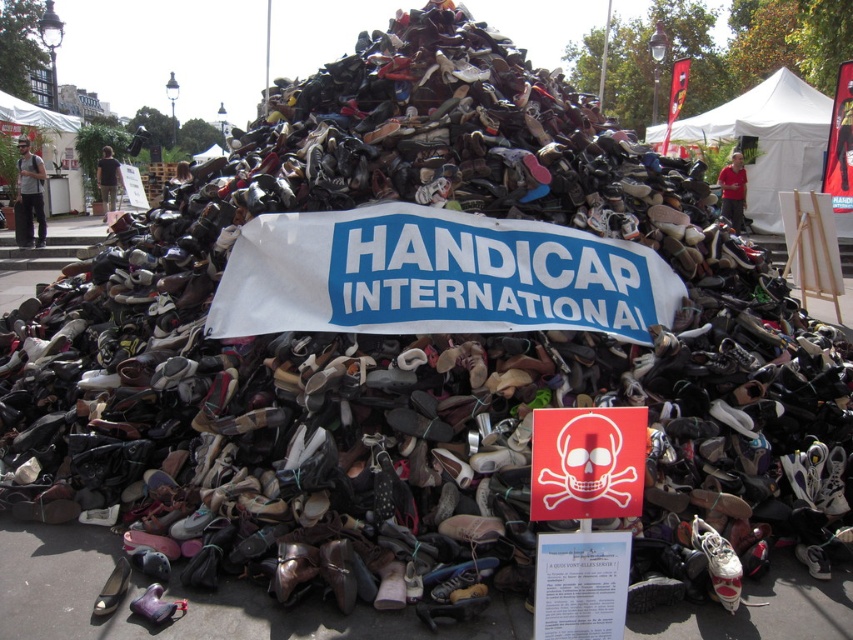
You are a photographer trying to capture the red skull sign at center and the shiny metallic shoe at lower left in a single frame. Based on their sizes, which object will appear larger in your photo?

The red skull sign at center appears larger in the photo because it has a greater height compared to the shiny metallic shoe at lower left.

You are standing at the base of the shoe pile and want to walk towards the HANDICAP INTERNATIONAL banner. Which of the two points, point (608, 410) or point (712, 548), would you pass first?

Point (608, 410) is in front of point (712, 548), so you would pass point (608, 410) first on your way to the banner.

You are a photographer standing in front of the shoe pile. You want to take a photo focusing on the white paper at center and the white matte shoe at center. Which object will appear larger in the photo?

The white paper at center will appear larger in the photo because it is closer to the viewer than the white matte shoe at center.